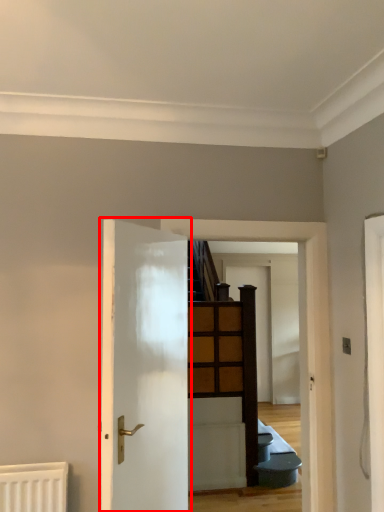
Question: From the image's perspective, considering the relative positions of door (annotated by the red box) and door in the image provided, where is door (annotated by the red box) located with respect to the staircase?

Choices:
 (A) below
 (B) above

Answer: (B)